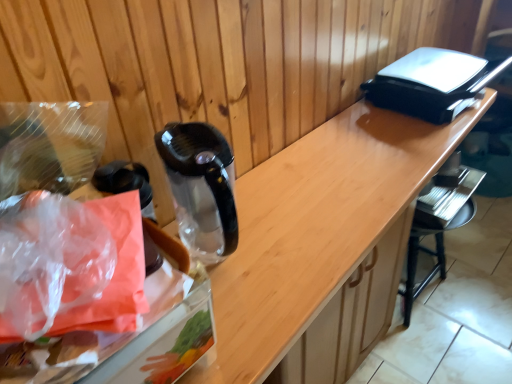
Question: From the image's perspective, is black plastic bar stool at lower right below transparent plastic bag at left?

Choices:
 (A) yes
 (B) no

Answer: (A)

Question: Does black plastic bar stool at lower right contain transparent plastic bag at left?

Choices:
 (A) no
 (B) yes

Answer: (A)

Question: Is black plastic bar stool at lower right aimed at transparent plastic bag at left?

Choices:
 (A) no
 (B) yes

Answer: (A)

Question: Considering the relative positions of black plastic bar stool at lower right and transparent plastic bag at left in the image provided, is black plastic bar stool at lower right to the right of transparent plastic bag at left from the viewer's perspective?

Choices:
 (A) yes
 (B) no

Answer: (A)

Question: Is the depth of black plastic bar stool at lower right less than that of transparent plastic bag at left?

Choices:
 (A) no
 (B) yes

Answer: (A)

Question: Looking at their shapes, would you say wooden counter at center is wider or thinner than translucent plastic bag at left?

Choices:
 (A) wide
 (B) thin

Answer: (A)

Question: Is wooden counter at center in front of or behind translucent plastic bag at left in the image?

Choices:
 (A) behind
 (B) front

Answer: (A)

Question: From the image's perspective, is wooden counter at center above or below translucent plastic bag at left?

Choices:
 (A) above
 (B) below

Answer: (B)

Question: From a real-world perspective, is wooden counter at center physically located above or below translucent plastic bag at left?

Choices:
 (A) above
 (B) below

Answer: (B)

Question: Do you think transparent plastic bag at left is within wooden counter at center, or outside of it?

Choices:
 (A) outside
 (B) inside

Answer: (A)

Question: Relative to wooden counter at center, is transparent plastic bag at left in front or behind?

Choices:
 (A) front
 (B) behind

Answer: (B)

Question: From a real-world perspective, is transparent plastic bag at left positioned above or below wooden counter at center?

Choices:
 (A) above
 (B) below

Answer: (A)

Question: Based on their sizes in the image, would you say transparent plastic bag at left is bigger or smaller than wooden counter at center?

Choices:
 (A) small
 (B) big

Answer: (A)

Question: Looking at the image, does wooden counter at center seem bigger or smaller compared to transparent plastic bag at left?

Choices:
 (A) big
 (B) small

Answer: (A)

Question: Looking at their shapes, would you say wooden counter at center is wider or thinner than transparent plastic bag at left?

Choices:
 (A) wide
 (B) thin

Answer: (A)